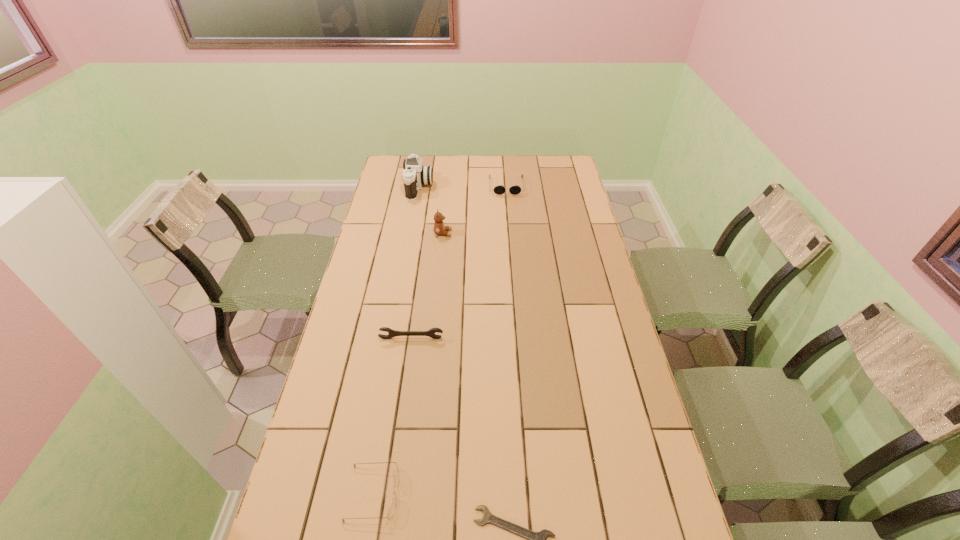
At what (x,y) coordinates should I click in order to perform the action: click on the tallest object. Please return your answer as a coordinate pair (x, y). Looking at the image, I should click on (415, 175).

This screenshot has width=960, height=540. In order to click on the fourth nearest object in this screenshot , I will do `click(439, 228)`.

This screenshot has width=960, height=540. Find the location of `teddy bear`. teddy bear is located at coordinates tap(439, 228).

This screenshot has width=960, height=540. I want to click on sunglasses, so click(x=498, y=189).

Locate an element on the screen. This screenshot has width=960, height=540. the left wrench is located at coordinates (392, 333).

At what (x,y) coordinates should I click in order to perform the action: click on the farther wrench. Please return your answer as a coordinate pair (x, y). Looking at the image, I should click on (392, 333).

Image resolution: width=960 pixels, height=540 pixels. What are the coordinates of `spectacles` in the screenshot? It's located at (391, 510).

This screenshot has height=540, width=960. Find the location of `free space located on the right of the tallest object`. free space located on the right of the tallest object is located at coordinates (475, 187).

Image resolution: width=960 pixels, height=540 pixels. Find the location of `free location located 0.100m on the front-facing side of the fourth nearest object`. free location located 0.100m on the front-facing side of the fourth nearest object is located at coordinates (476, 233).

This screenshot has height=540, width=960. In order to click on vacant point located on the front-facing side of the sunglasses in this screenshot , I will do `click(508, 204)`.